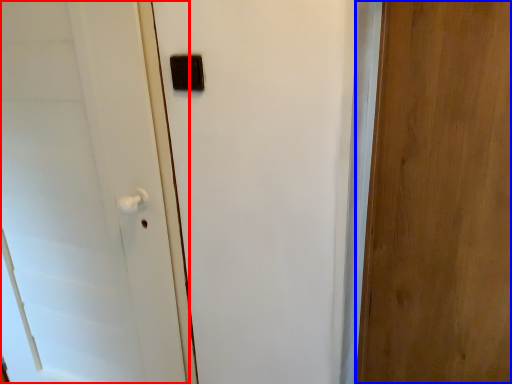
Question: Among these objects, which one is farthest to the camera, door (highlighted by a red box) or door (highlighted by a blue box)?

Choices:
 (A) door
 (B) door

Answer: (A)